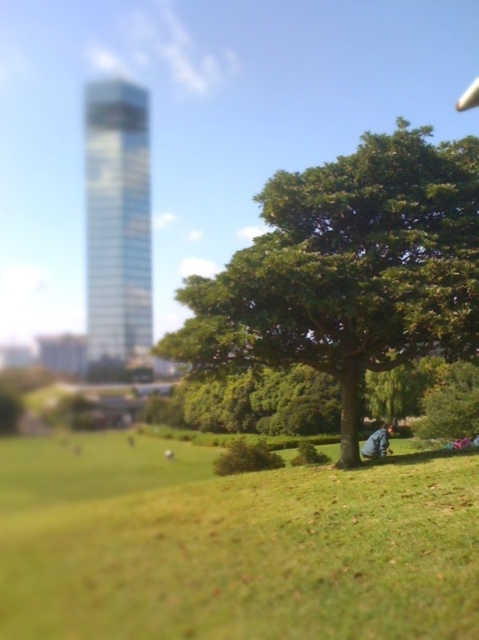
Based on the photo, you are standing in the park and want to take a photo of the green leafy tree at center. To ensure the tree is centered in your photo, where should you position yourself relative to the tree?

To center the green leafy tree at center in your photo, you should position yourself directly in front of it at the point corresponding to its 2D location at coordinates approximately 0.422 on the x axis and 0.729 on the y axis.

You are a gardener planning to plant a new flower bed between the green grassy field at lower center and the green leafy tree at center. Based on their positions, where should the flower bed be placed?

The flower bed should be placed between the green grassy field at lower center and the green leafy tree at center, as the green grassy field at lower center is located below the green leafy tree at center.

You are a photographer standing in the park and want to take a photo of the green leafy tree at center and the blue denim jeans at lower right. Which object is positioned closer to you?

The green leafy tree at center is closer to the viewer than the blue denim jeans at lower right, so the photographer should focus on capturing the tree first as it is nearer.